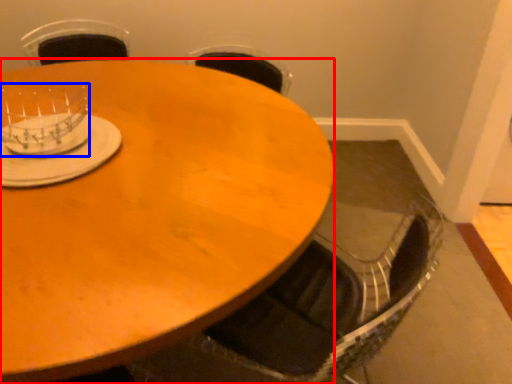
Question: Which object appears farthest to the camera in this image, coffee table (highlighted by a red box) or tableware (highlighted by a blue box)?

Choices:
 (A) coffee table
 (B) tableware

Answer: (B)